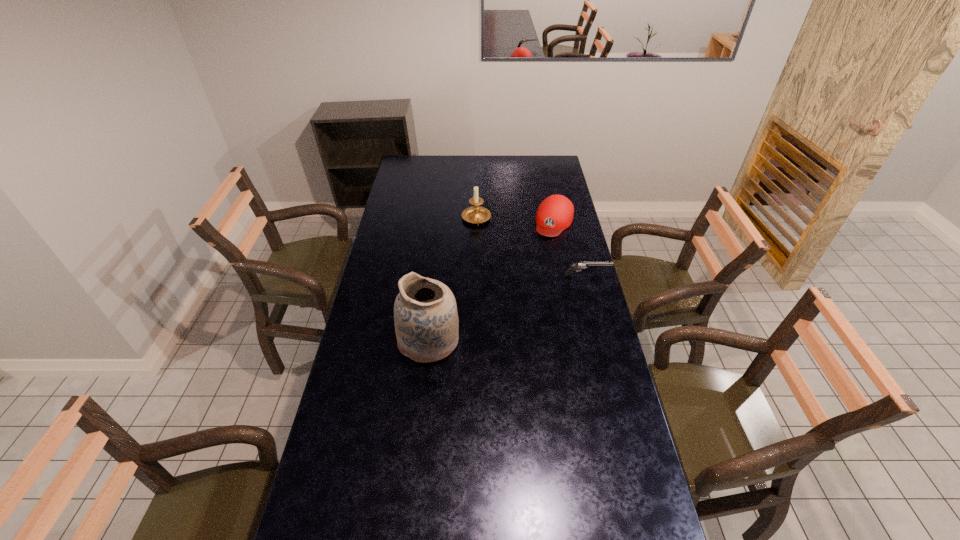
This screenshot has width=960, height=540. In order to click on vacant region between the candle holder and the pistol in this screenshot , I will do `click(532, 247)`.

Image resolution: width=960 pixels, height=540 pixels. In order to click on unoccupied area between the third shortest object and the baseball cap in this screenshot , I will do `click(516, 220)`.

The width and height of the screenshot is (960, 540). What are the coordinates of `empty location between the pistol and the candle holder` in the screenshot? It's located at (532, 247).

This screenshot has width=960, height=540. What are the coordinates of `vacant area that lies between the baseball cap and the candle holder` in the screenshot? It's located at (516, 220).

At what (x,y) coordinates should I click in order to perform the action: click on free spot between the third farthest object and the nearest object. Please return your answer as a coordinate pair (x, y). Looking at the image, I should click on (508, 308).

Identify the location of free spot between the pottery and the baseball cap. pos(492,281).

At what (x,y) coordinates should I click in order to perform the action: click on free space between the shortest object and the baseball cap. Please return your answer as a coordinate pair (x, y). Looking at the image, I should click on (571, 248).

In order to click on vacant space in between the shortest object and the nearest object in this screenshot , I will do `click(508, 308)`.

Find the location of a particular element. vacant space that's between the candle holder and the baseball cap is located at coordinates (516, 220).

Where is `empty space that is in between the candle holder and the shortest object`? The height and width of the screenshot is (540, 960). empty space that is in between the candle holder and the shortest object is located at coordinates (532, 247).